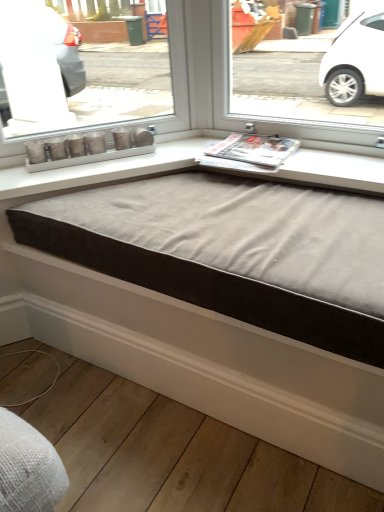
Question: Could you tell me if suede-like fabric bed frame at center is facing matte silver candlesticks at center?

Choices:
 (A) no
 (B) yes

Answer: (A)

Question: From the image's perspective, would you say suede-like fabric bed frame at center is shown under matte silver candlesticks at center?

Choices:
 (A) no
 (B) yes

Answer: (B)

Question: Does suede-like fabric bed frame at center come in front of matte silver candlesticks at center?

Choices:
 (A) no
 (B) yes

Answer: (B)

Question: Does suede-like fabric bed frame at center appear on the left side of matte silver candlesticks at center?

Choices:
 (A) no
 (B) yes

Answer: (A)

Question: Considering the relative sizes of suede-like fabric bed frame at center and matte silver candlesticks at center in the image provided, is suede-like fabric bed frame at center taller than matte silver candlesticks at center?

Choices:
 (A) no
 (B) yes

Answer: (A)

Question: Does suede-like fabric bed frame at center have a smaller size compared to matte silver candlesticks at center?

Choices:
 (A) no
 (B) yes

Answer: (A)

Question: From the image's perspective, is matte silver candlesticks at center over printed glossy magazine at center?

Choices:
 (A) no
 (B) yes

Answer: (A)

Question: Can you confirm if matte silver candlesticks at center is bigger than printed glossy magazine at center?

Choices:
 (A) yes
 (B) no

Answer: (B)

Question: Is matte silver candlesticks at center far away from printed glossy magazine at center?

Choices:
 (A) no
 (B) yes

Answer: (A)

Question: Considering the relative sizes of matte silver candlesticks at center and printed glossy magazine at center in the image provided, is matte silver candlesticks at center wider than printed glossy magazine at center?

Choices:
 (A) yes
 (B) no

Answer: (B)

Question: Does matte silver candlesticks at center come behind printed glossy magazine at center?

Choices:
 (A) no
 (B) yes

Answer: (B)

Question: Is matte silver candlesticks at center closer to camera compared to printed glossy magazine at center?

Choices:
 (A) no
 (B) yes

Answer: (A)

Question: Is white wood baseboard at lower center oriented towards suede-like fabric bed frame at center?

Choices:
 (A) yes
 (B) no

Answer: (B)